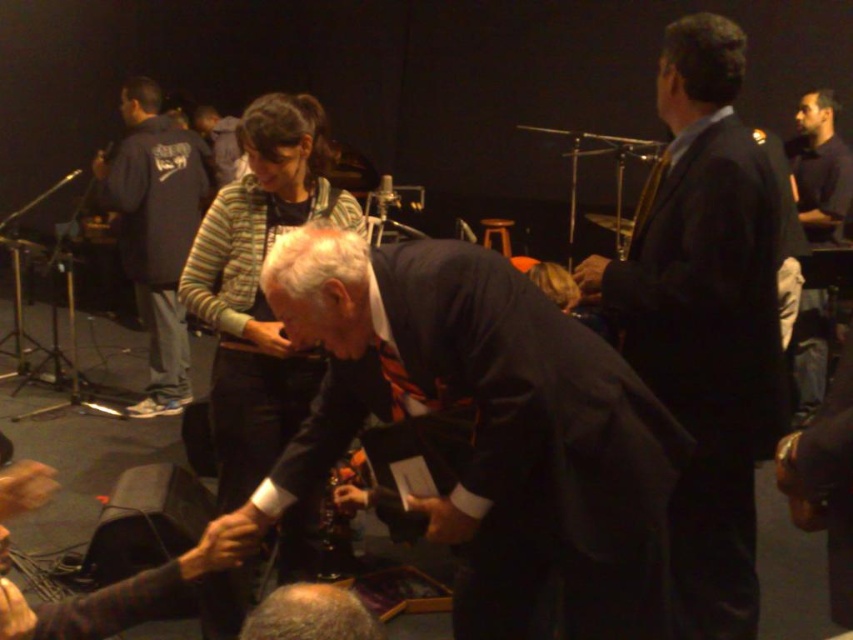
Question: Is the position of striped sweater at center less distant than that of dark gray suit at upper center?

Choices:
 (A) no
 (B) yes

Answer: (B)

Question: Is dark suit at center to the left of striped sweater at center from the viewer's perspective?

Choices:
 (A) no
 (B) yes

Answer: (A)

Question: Which of the following is the closest to the observer?

Choices:
 (A) dark suit at center
 (B) dark blue suit at center

Answer: (B)

Question: Does dark blue suit at center appear over striped sweater at center?

Choices:
 (A) no
 (B) yes

Answer: (A)

Question: Estimate the real-world distances between objects in this image. Which object is closer to the dark gray suit at upper center?

Choices:
 (A) dark suit at center
 (B) striped sweater at center
 (C) dark blue shirt at right

Answer: (B)

Question: Which object is farther from the camera taking this photo?

Choices:
 (A) dark suit at center
 (B) striped sweater at center

Answer: (B)